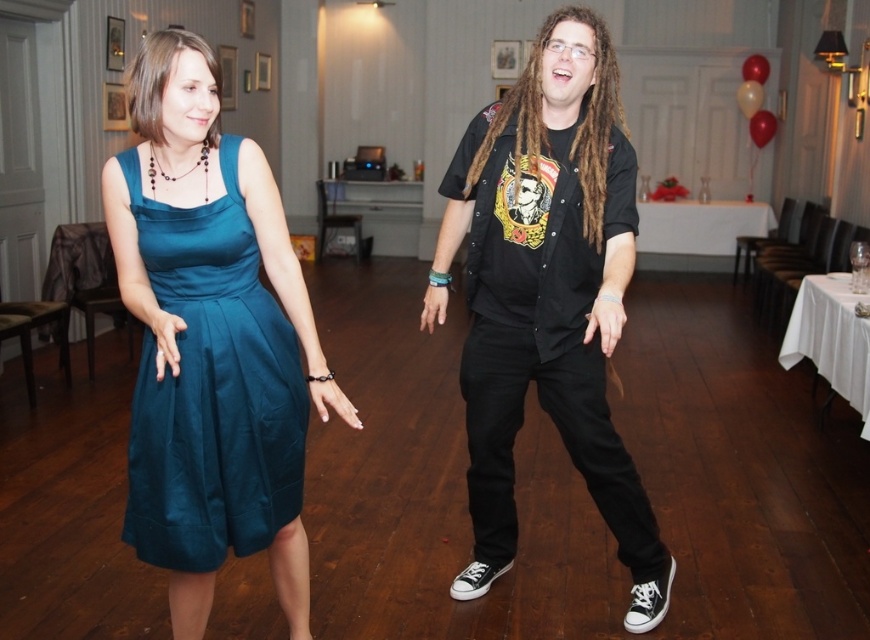
Does teal satin dress at center appear on the right side of teal satin dress at left?

Indeed, teal satin dress at center is positioned on the right side of teal satin dress at left.

The height and width of the screenshot is (640, 870). What are the coordinates of `teal satin dress at center` in the screenshot? It's located at (547, 296).

This screenshot has height=640, width=870. What do you see at coordinates (547, 296) in the screenshot? I see `teal satin dress at center` at bounding box center [547, 296].

What do you see at coordinates (547, 296) in the screenshot? I see `teal satin dress at center` at bounding box center [547, 296].

Where is `teal satin dress at center`? The height and width of the screenshot is (640, 870). teal satin dress at center is located at coordinates (547, 296).

At what (x,y) coordinates should I click in order to perform the action: click on black matte shirt at center. Please return your answer as a coordinate pair (x, y). This screenshot has width=870, height=640. Looking at the image, I should click on (547, 296).

Which is in front, point (631, 572) or point (269, 358)?

Point (269, 358) is more forward.

Describe the element at coordinates (547, 296) in the screenshot. This screenshot has height=640, width=870. I see `black matte shirt at center` at that location.

Find the location of `black matte shirt at center`. black matte shirt at center is located at coordinates (547, 296).